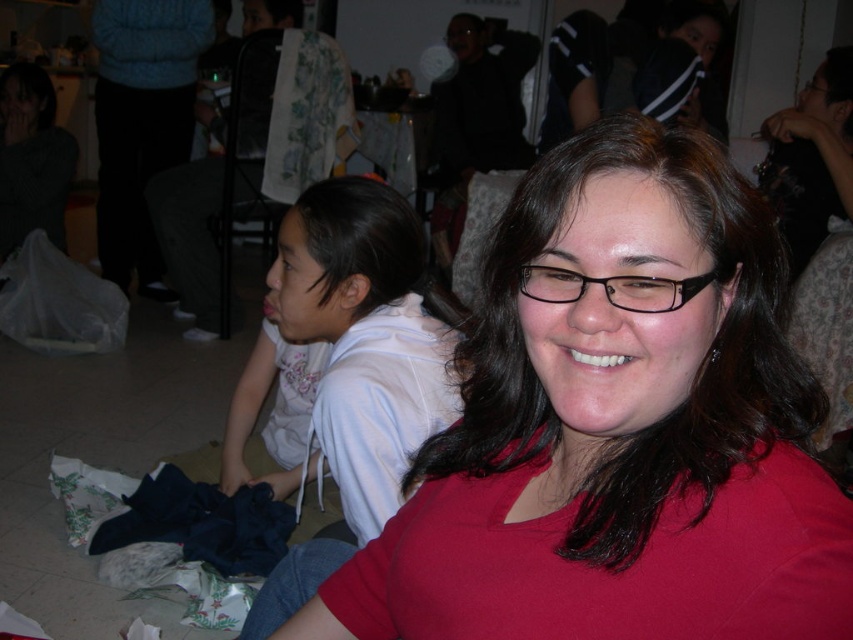
Question: Does matte red shirt at center have a greater width compared to white cotton hoodie at lower left?

Choices:
 (A) no
 (B) yes

Answer: (B)

Question: Which object is closer to the camera taking this photo?

Choices:
 (A) black plastic glasses at center
 (B) matte red shirt at center
 (C) white cotton hoodie at lower left

Answer: (B)

Question: In this image, where is white cotton hoodie at lower left located relative to black plastic glasses at center?

Choices:
 (A) below
 (B) above

Answer: (A)

Question: Which point is closer to the camera?

Choices:
 (A) (270, 604)
 (B) (636, 502)
 (C) (666, 300)

Answer: (C)

Question: Among these points, which one is nearest to the camera?

Choices:
 (A) (515, 616)
 (B) (680, 305)

Answer: (B)

Question: Does matte red shirt at center have a greater width compared to black plastic glasses at center?

Choices:
 (A) no
 (B) yes

Answer: (B)